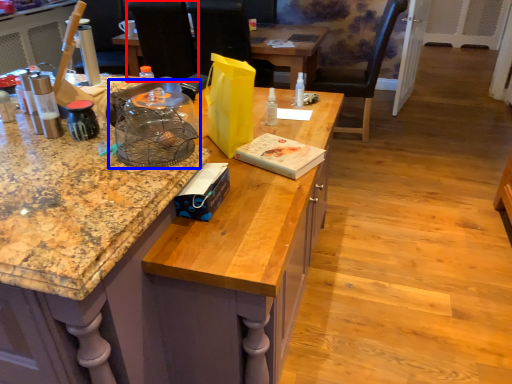
Question: Which object appears farthest to the camera in this image, armchair (highlighted by a red box) or bird cage (highlighted by a blue box)?

Choices:
 (A) armchair
 (B) bird cage

Answer: (A)